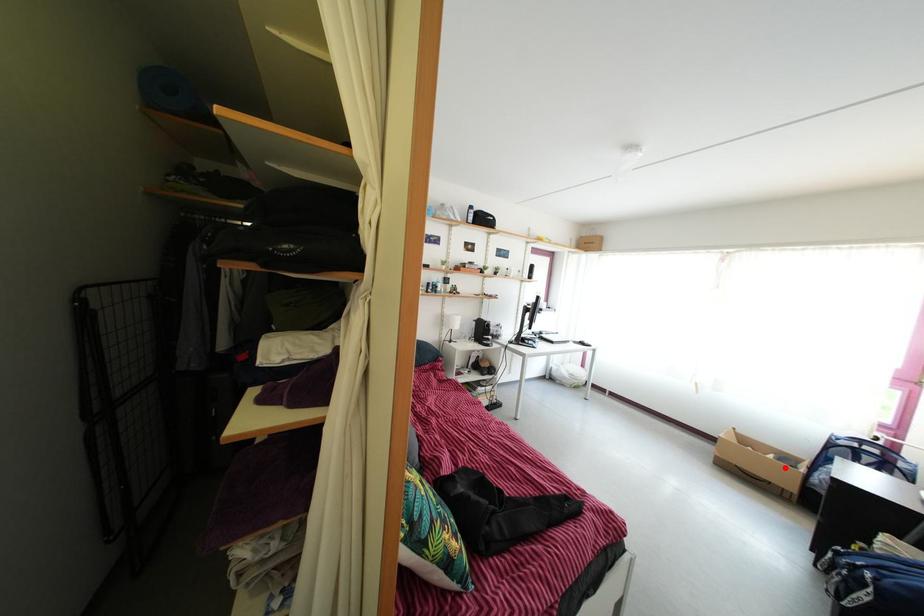
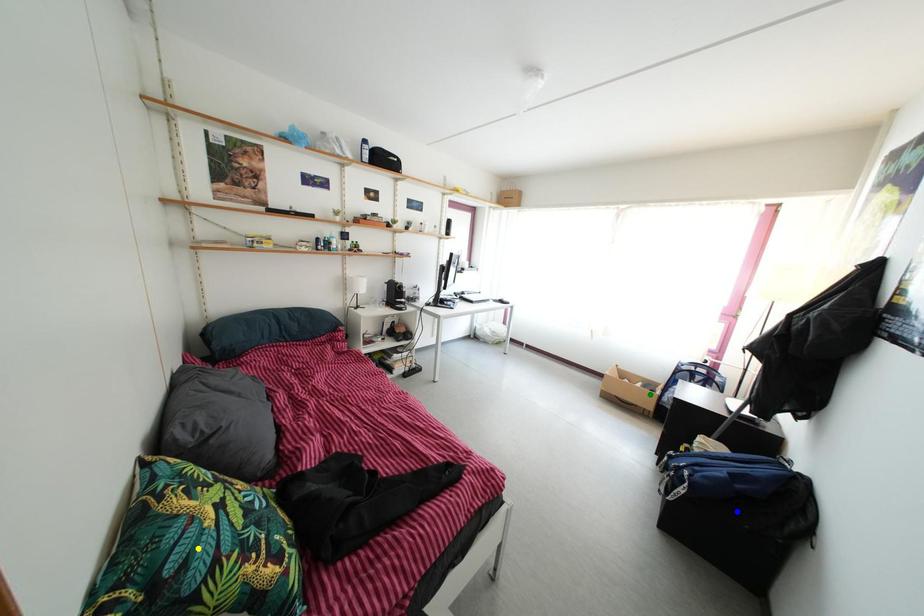
Question: I am providing you with two images of the same scene from different viewpoints. A red point is marked on the first image. You are given multiple points on the second image. In image 2, which mark is for the same physical point as the one in image 1?

Choices:
 (A) blue point
 (B) yellow point
 (C) green point

Answer: (C)